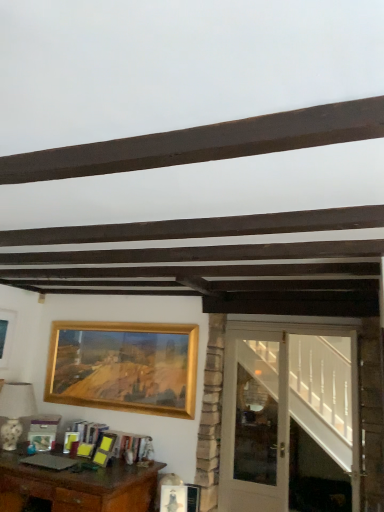
This screenshot has height=512, width=384. What are the coordinates of `blank space situated above white glass door at right (from a real-world perspective)` in the screenshot? It's located at (256, 331).